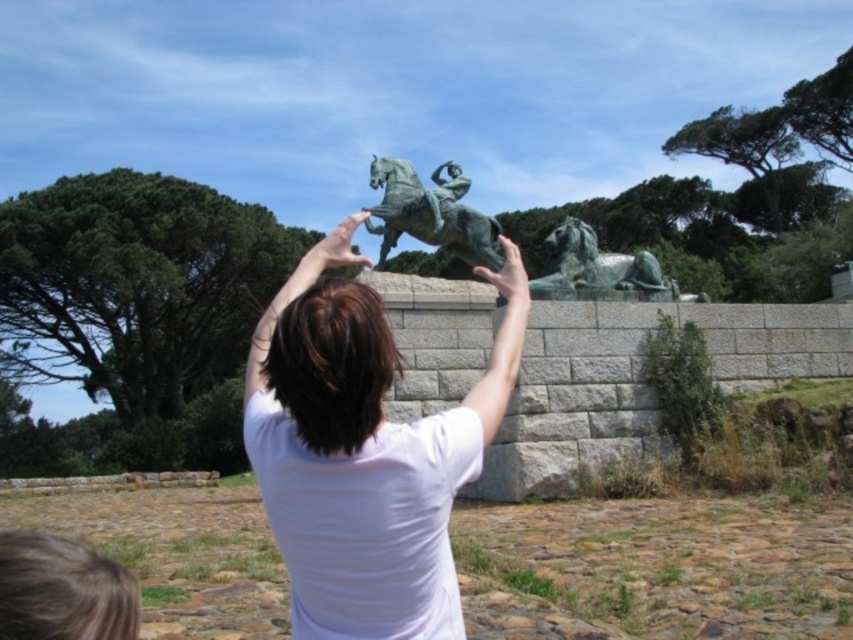
Who is taller, white matte shirt at center or green polished bronze horseman at center?

white matte shirt at center

What do you see at coordinates (364, 452) in the screenshot?
I see `white matte shirt at center` at bounding box center [364, 452].

Find the location of a particular element. This screenshot has height=640, width=853. white matte shirt at center is located at coordinates (364, 452).

Is white matte shirt at center positioned behind green polished stone horse at right?

No.

The image size is (853, 640). Describe the element at coordinates (364, 452) in the screenshot. I see `white matte shirt at center` at that location.

At what (x,y) coordinates should I click in order to perform the action: click on white matte shirt at center. Please return your answer as a coordinate pair (x, y). Image resolution: width=853 pixels, height=640 pixels. Looking at the image, I should click on (364, 452).

Identify the location of green polished bronze horseman at center. This screenshot has width=853, height=640. (430, 212).

Consider the image. Can you confirm if green polished bronze horseman at center is positioned below green polished stone horse at right?

A: No, green polished bronze horseman at center is not below green polished stone horse at right.

Does point (392, 236) lie in front of point (560, 272)?

No, it is not.

This screenshot has width=853, height=640. I want to click on green polished bronze horseman at center, so click(x=430, y=212).